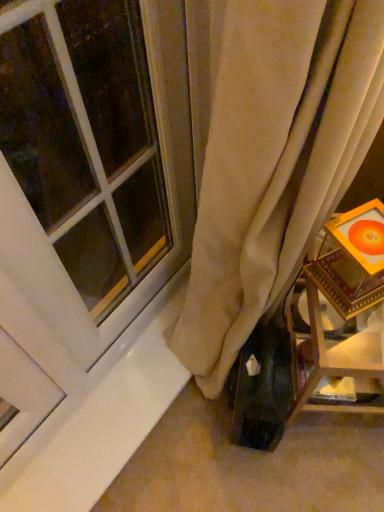
Question: Based on their sizes in the image, would you say wooden framed picture at right is bigger or smaller than white glass window at upper left?

Choices:
 (A) small
 (B) big

Answer: (B)

Question: Is wooden framed picture at right inside the boundaries of white glass window at upper left, or outside?

Choices:
 (A) inside
 (B) outside

Answer: (B)

Question: From a real-world perspective, is wooden framed picture at right positioned above or below white glass window at upper left?

Choices:
 (A) below
 (B) above

Answer: (A)

Question: Looking at the image, does white glass window at upper left seem bigger or smaller compared to wooden framed picture at right?

Choices:
 (A) small
 (B) big

Answer: (A)

Question: Is white glass window at upper left wider or thinner than wooden framed picture at right?

Choices:
 (A) thin
 (B) wide

Answer: (A)

Question: Considering the positions of point (11, 53) and point (347, 317), is point (11, 53) closer or farther from the camera than point (347, 317)?

Choices:
 (A) farther
 (B) closer

Answer: (A)

Question: Is white glass window at upper left in front of or behind wooden framed picture at right in the image?

Choices:
 (A) behind
 (B) front

Answer: (B)